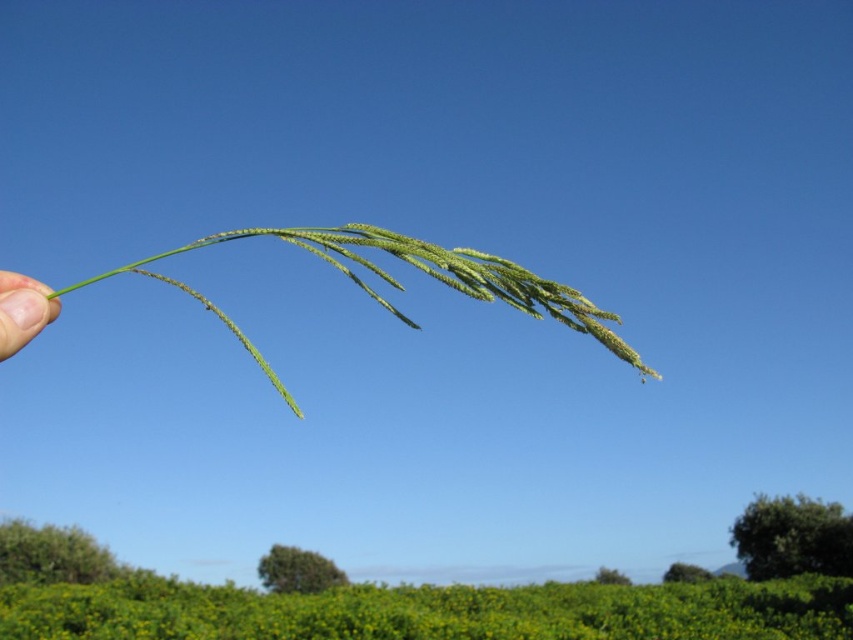
Question: Estimate the real-world distances between objects in this image. Which object is closer to the green leafy hedge at lower right?

Choices:
 (A) skinny green stem at left
 (B) green matte grass at center

Answer: (B)

Question: Is green matte grass at center bigger than green leafy hedge at lower right?

Choices:
 (A) no
 (B) yes

Answer: (A)

Question: Is green matte grass at center to the left of green leafy hedge at lower right from the viewer's perspective?

Choices:
 (A) no
 (B) yes

Answer: (B)

Question: Does green matte grass at center appear over skinny green stem at left?

Choices:
 (A) yes
 (B) no

Answer: (A)

Question: Considering the real-world distances, which object is farthest from the green leafy hedge at lower right?

Choices:
 (A) green matte grass at center
 (B) skinny green stem at left

Answer: (B)

Question: Which is nearer to the green leafy hedge at lower right?

Choices:
 (A) green matte grass at center
 (B) skinny green stem at left

Answer: (A)